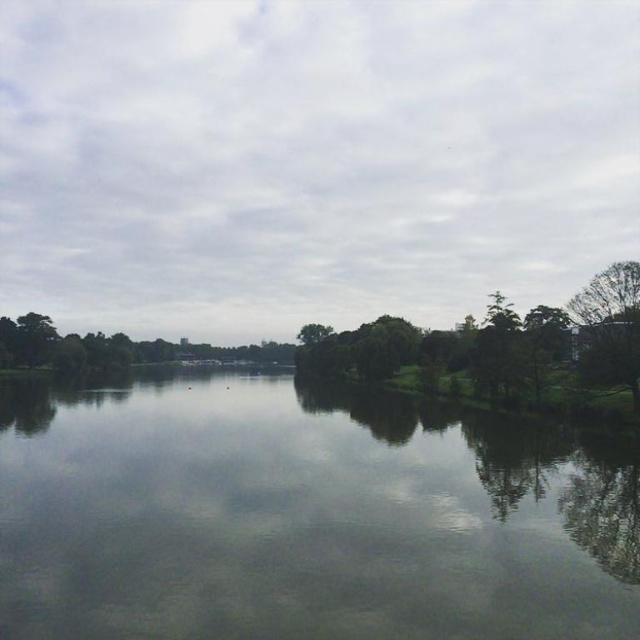
Question: Can you confirm if clear water at center is smaller than green leafy tree at right?

Choices:
 (A) no
 (B) yes

Answer: (A)

Question: Which object appears closest to the camera in this image?

Choices:
 (A) green leafy tree at right
 (B) clear water at center
 (C) green leafy trees at center

Answer: (B)

Question: Which object is the farthest from the green leafy trees at center?

Choices:
 (A) green leafy tree at right
 (B) clear water at center

Answer: (B)

Question: Where is green leafy trees at center located in relation to green leafy tree at right in the image?

Choices:
 (A) right
 (B) left

Answer: (A)

Question: Does clear water at center lie in front of green leafy tree at right?

Choices:
 (A) no
 (B) yes

Answer: (B)

Question: Which object is the closest to the green leafy trees at center?

Choices:
 (A) clear water at center
 (B) green leafy tree at right

Answer: (B)